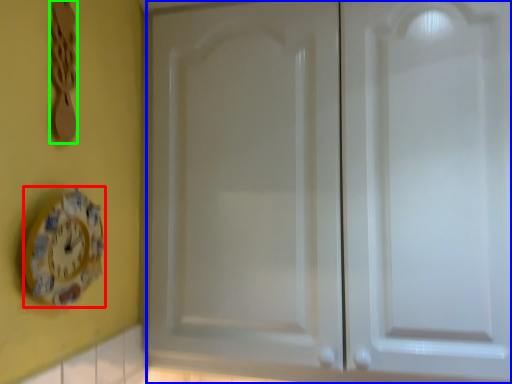
Question: Considering the real-world distances, which object is farthest from clock (highlighted by a red box)? door (highlighted by a blue box) or spoon (highlighted by a green box)?

Choices:
 (A) door
 (B) spoon

Answer: (A)